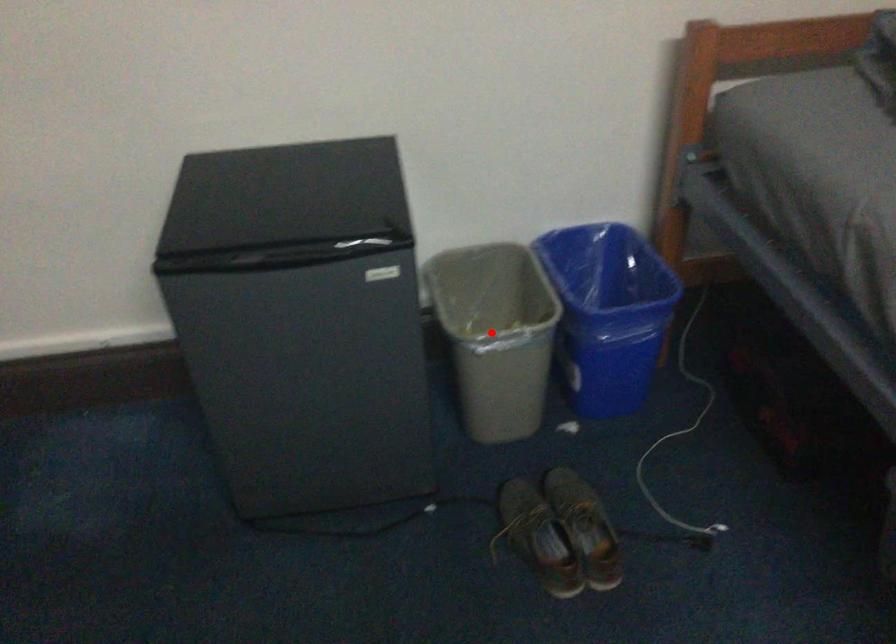
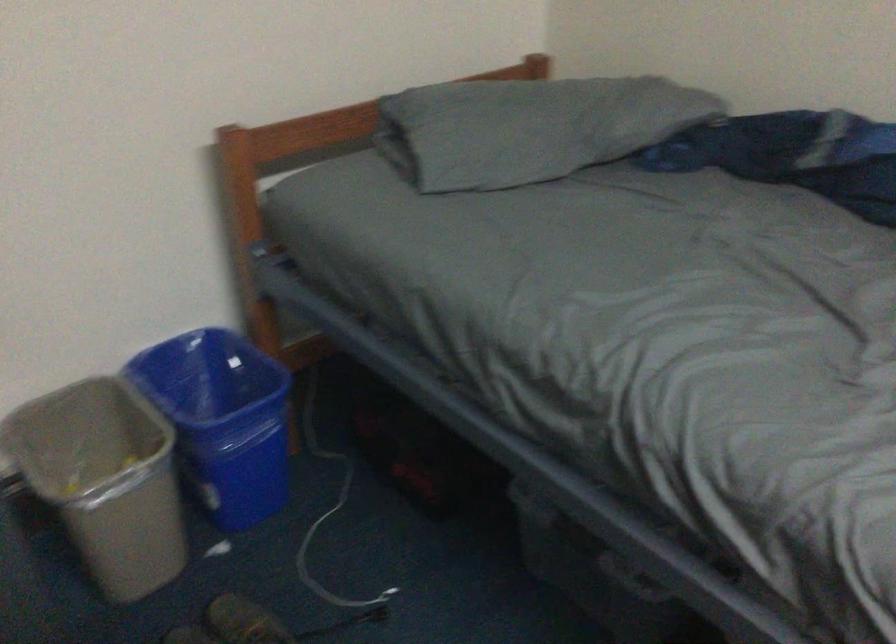
Question: I am providing you with two images of the same scene from different viewpoints. Given a red point in image1, look at the same physical point in image2. Is it:

Choices:
 (A) Closer to the viewpoint
 (B) Farther from the viewpoint

Answer: (A)